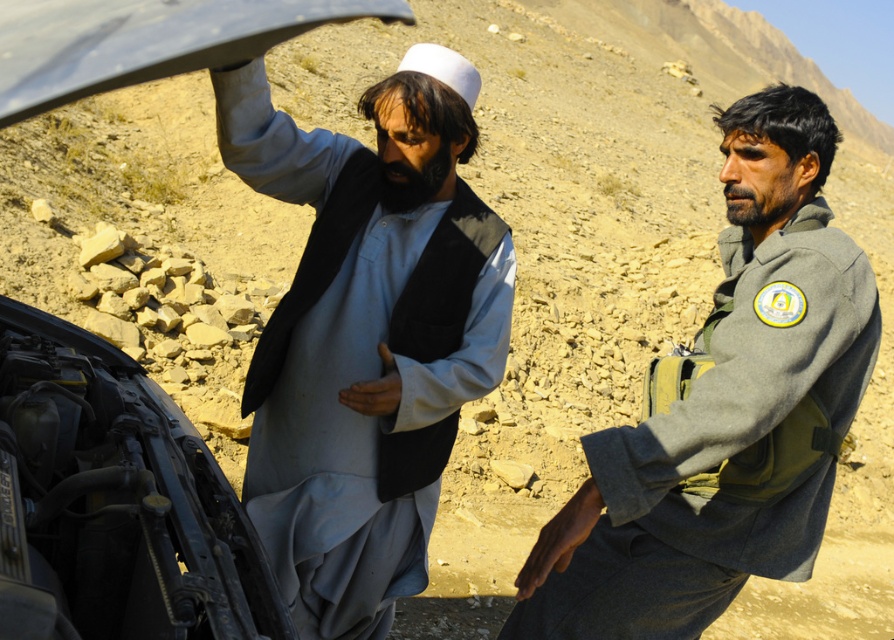
Question: Can you confirm if light blue fabric at center is wider than gray fleece jacket at right?

Choices:
 (A) yes
 (B) no

Answer: (B)

Question: Does gray fleece jacket at right have a larger size compared to metallic engine at lower left?

Choices:
 (A) no
 (B) yes

Answer: (B)

Question: Which object is closer to the camera taking this photo?

Choices:
 (A) metallic engine at lower left
 (B) metallic car hood at left

Answer: (A)

Question: Which object appears closest to the camera in this image?

Choices:
 (A) gray fleece jacket at right
 (B) metallic engine at lower left
 (C) metallic gray hood at upper left
 (D) light blue fabric at center

Answer: (C)

Question: Among these objects, which one is nearest to the camera?

Choices:
 (A) light blue fabric at center
 (B) metallic gray hood at upper left
 (C) metallic engine at lower left
 (D) metallic car hood at left

Answer: (B)

Question: Is the position of metallic car hood at left more distant than that of metallic gray hood at upper left?

Choices:
 (A) no
 (B) yes

Answer: (B)